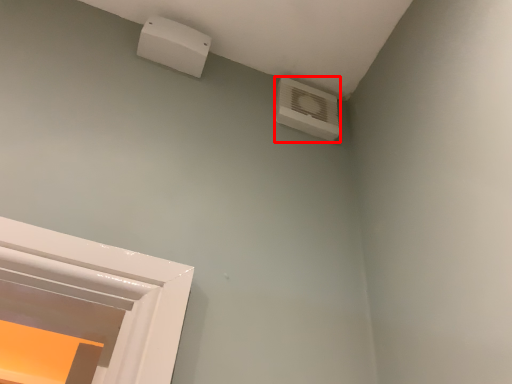
Question: Where is air conditioning (annotated by the red box) located in relation to electric outlet in the image?

Choices:
 (A) left
 (B) right

Answer: (B)